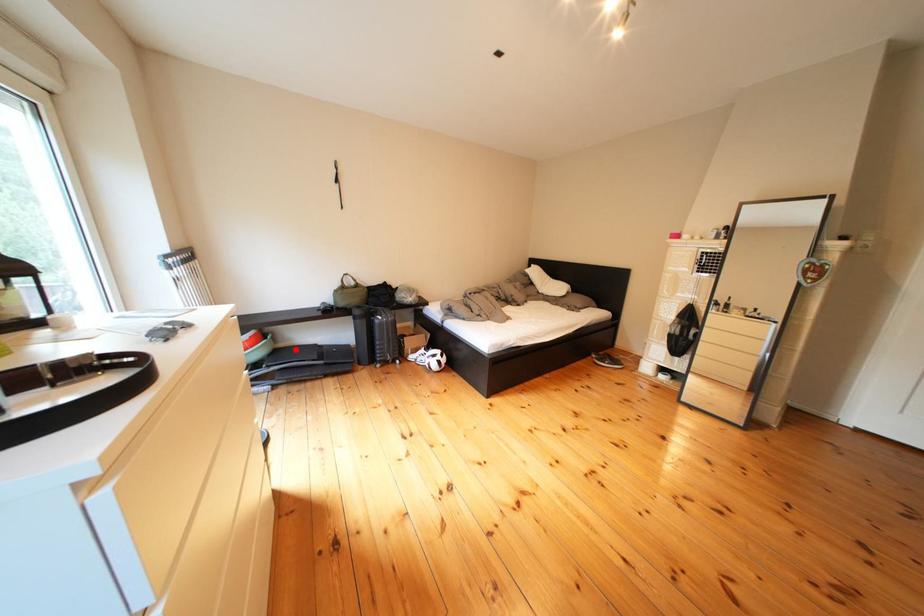
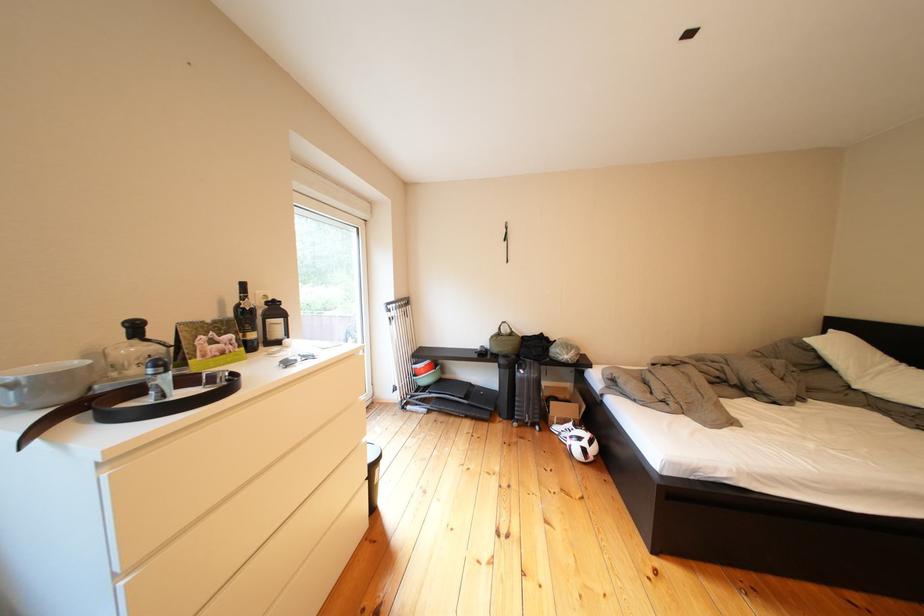
Question: I am providing you with two images of the same scene from different viewpoints. Given a red point in image1, look at the same physical point in image2. Is it:

Choices:
 (A) Closer to the viewpoint
 (B) Farther from the viewpoint

Answer: (B)